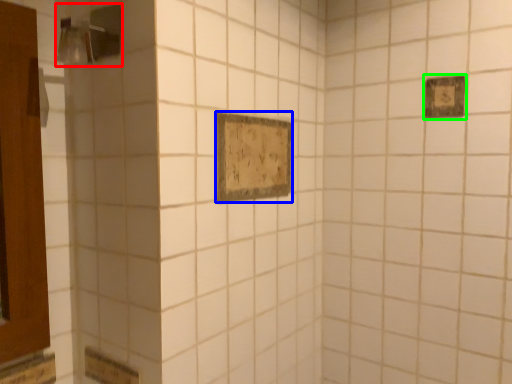
Question: Estimate the real-world distances between objects in this image. Which object is closer to shower (highlighted by a red box), rectangle (highlighted by a blue box) or rectangle (highlighted by a green box)?

Choices:
 (A) rectangle
 (B) rectangle

Answer: (A)